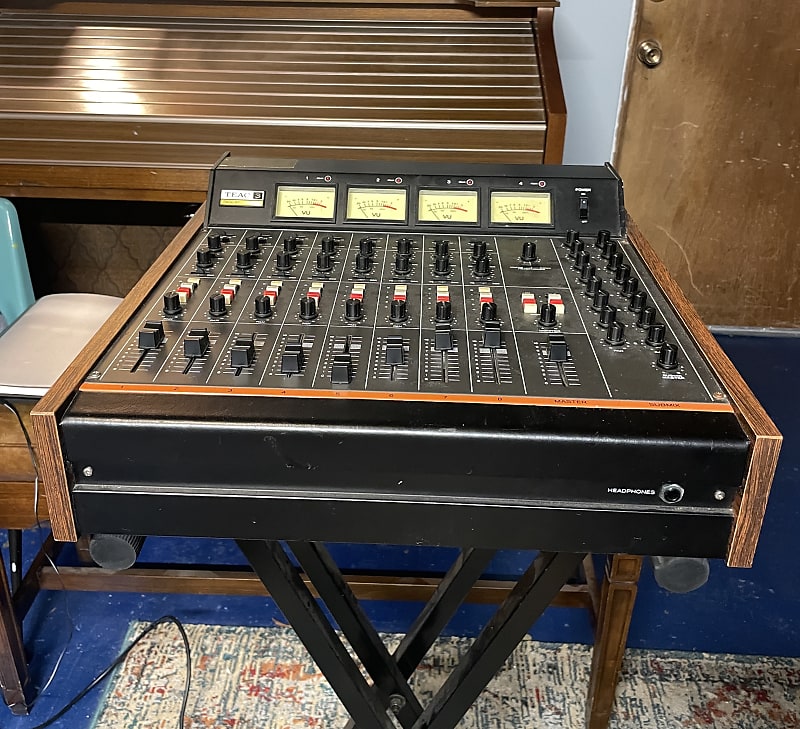
This screenshot has width=800, height=729. I want to click on black music box, so click(x=420, y=415).